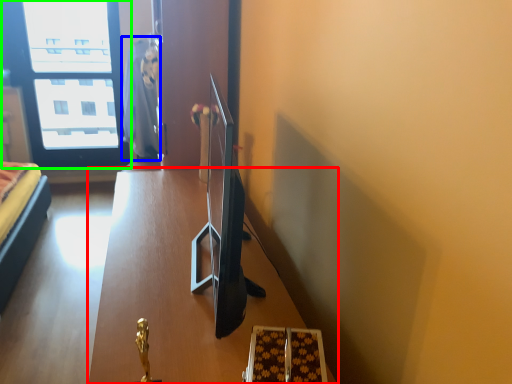
Question: Based on their relative distances, which object is nearer to table (highlighted by a red box)? Choose from robe (highlighted by a blue box) and window (highlighted by a green box).

Choices:
 (A) robe
 (B) window

Answer: (A)